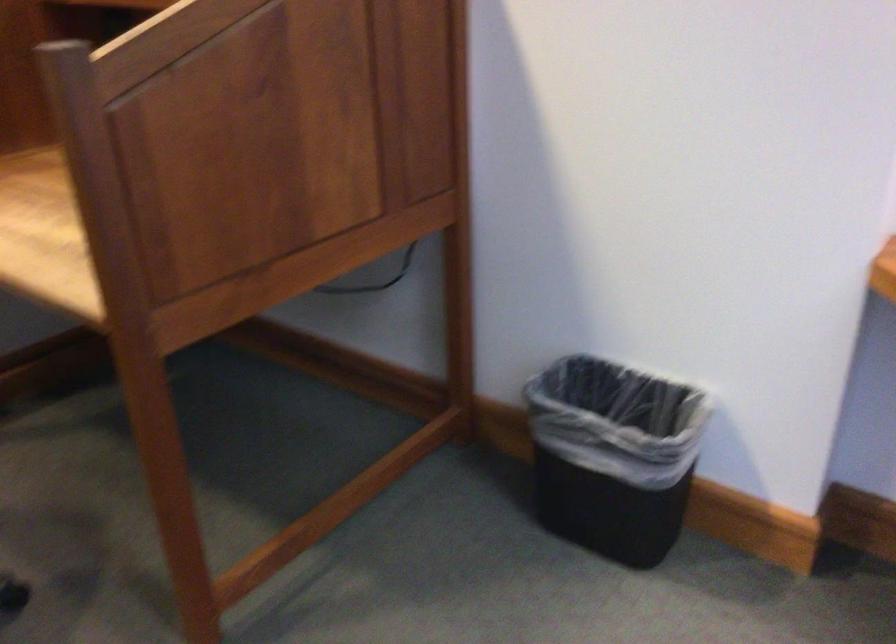
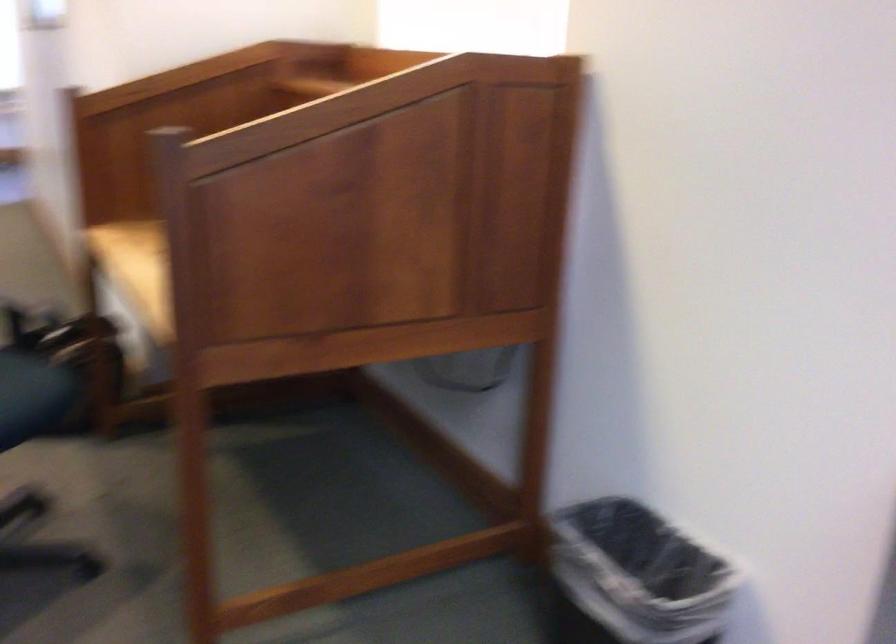
Question: The camera is either moving clockwise (left) or counter-clockwise (right) around the object. The first image is from the beginning of the video and the second image is from the end. Is the camera moving left or right when shooting the video?

Choices:
 (A) Left
 (B) Right

Answer: (B)